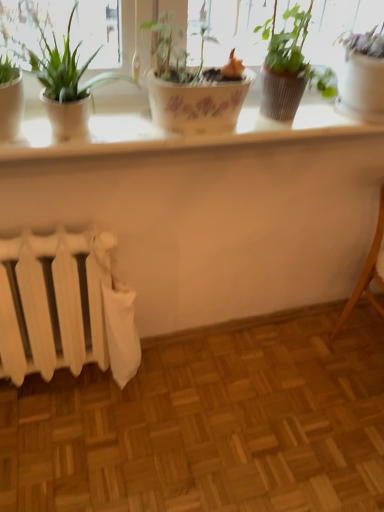
Find the location of a particular element. Image resolution: width=384 pixels, height=512 pixels. free space underneath green matte pot at upper center, which is counted as the second houseplant, starting from the right (from a real-world perspective) is located at coordinates (277, 120).